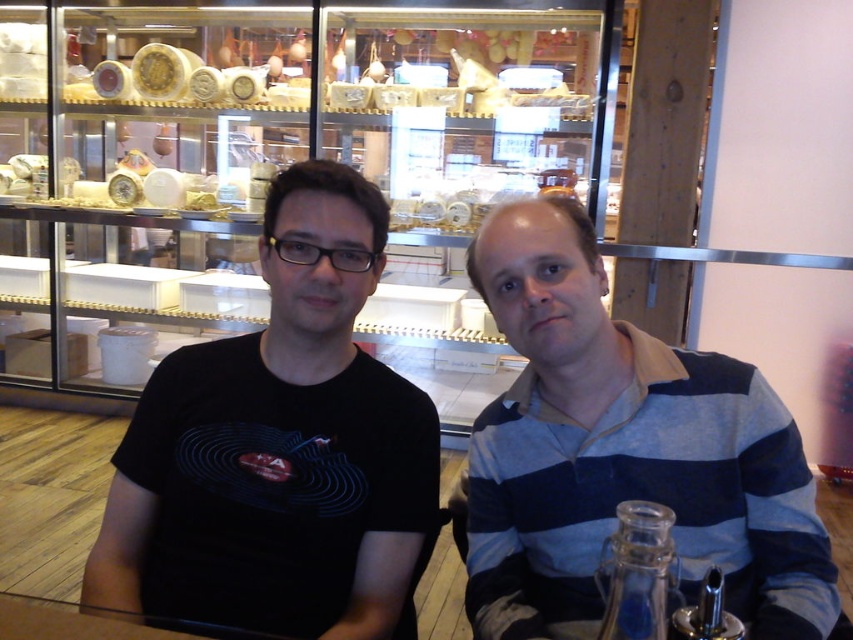
Question: Which of the following is the farthest from the observer?

Choices:
 (A) (554, 416)
 (B) (134, 458)

Answer: (B)

Question: Does black matte shirt at center appear over black matte t-shirt at left?

Choices:
 (A) yes
 (B) no

Answer: (B)

Question: Estimate the real-world distances between objects in this image. Which object is farther from the blue striped shirt at center?

Choices:
 (A) black matte shirt at center
 (B) black matte t-shirt at left

Answer: (B)

Question: Can you confirm if black matte t-shirt at left is positioned to the left of blue striped shirt at center?

Choices:
 (A) yes
 (B) no

Answer: (A)

Question: Which of the following is the farthest from the observer?

Choices:
 (A) (561, 520)
 (B) (717, 358)
 (C) (183, 467)

Answer: (C)

Question: Where is black matte shirt at center located in relation to blue striped shirt at center in the image?

Choices:
 (A) above
 (B) below

Answer: (A)